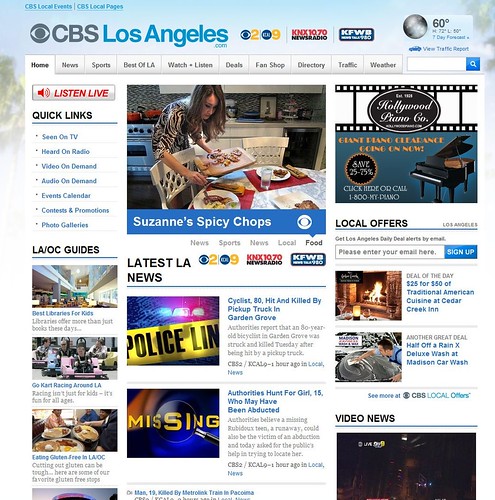
Identify the location of white table cloth. (316, 186).